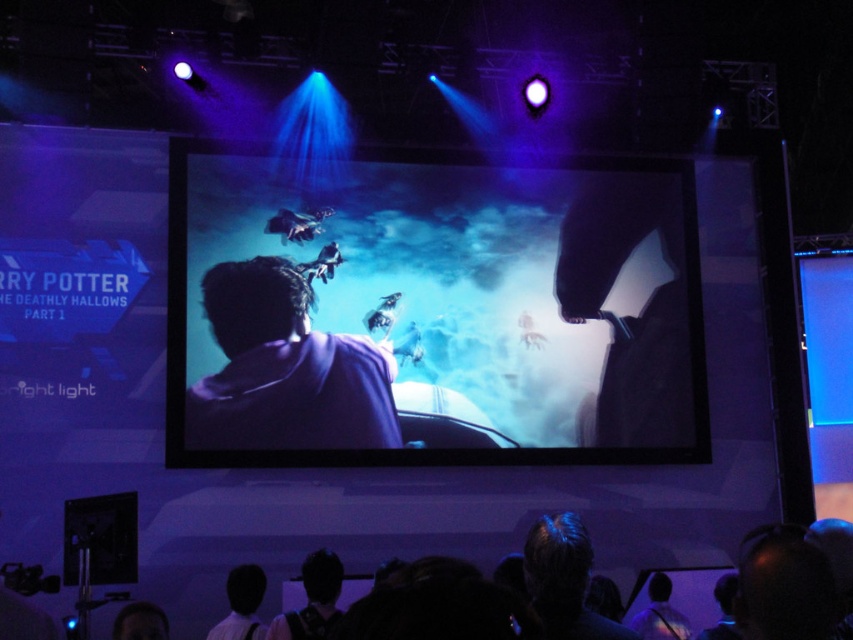
You are at the movie theater and want to know if the point labeled as point (537, 262) is located behind the point labeled as point (282, 390). Based on the scene description, can you determine their spatial relationship?

Yes, according to the description, point (537, 262) is behind point (282, 390).

You are a stagehand setting up for a movie premiere. You notice the matte black screen at center and the purple fabric at center. Which object is placed on top of the other?

The matte black screen at center is positioned over purple fabric at center.

You are an event organizer planning to place a promotional banner on the stage. The banner is 2 meters wide. You have two options on the stage, the matte black screen at center and the purple fabric at center. Which surface can accommodate the banner without it hanging off the edge?

The matte black screen at center is bigger than the purple fabric at center, so the banner can be placed on the matte black screen at center without hanging off the edge.